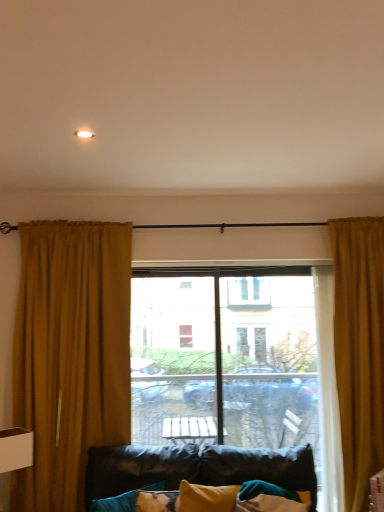
Question: Should I look upward or downward to see golden textured curtain at right, which appears as the 1th curtain when viewed from the right?

Choices:
 (A) down
 (B) up

Answer: (A)

Question: Can you confirm if golden textured curtain at right, which appears as the 1th curtain when viewed from the right, is wider than velvet teal pillow at lower left?

Choices:
 (A) no
 (B) yes

Answer: (B)

Question: Can you confirm if golden textured curtain at right, which is the 2th curtain in left-to-right order, is taller than velvet teal pillow at lower left?

Choices:
 (A) yes
 (B) no

Answer: (A)

Question: Is the depth of golden textured curtain at right, which is the 2th curtain in left-to-right order, greater than that of velvet teal pillow at lower left?

Choices:
 (A) no
 (B) yes

Answer: (B)

Question: Is golden textured curtain at right, which is the 2th curtain in left-to-right order, at the left side of velvet teal pillow at lower left?

Choices:
 (A) no
 (B) yes

Answer: (A)

Question: Can we say golden textured curtain at right, which is the 2th curtain in left-to-right order, lies outside velvet teal pillow at lower left?

Choices:
 (A) yes
 (B) no

Answer: (A)

Question: Does golden textured curtain at right, which is the 2th curtain in left-to-right order, have a larger size compared to velvet teal pillow at lower left?

Choices:
 (A) yes
 (B) no

Answer: (A)

Question: Is velvet teal pillow at lower left bigger than mustard velvet curtain at left, placed as the second curtain when sorted from right to left?

Choices:
 (A) no
 (B) yes

Answer: (A)

Question: From the image's perspective, would you say velvet teal pillow at lower left is positioned over mustard velvet curtain at left, the 1th curtain when ordered from left to right?

Choices:
 (A) no
 (B) yes

Answer: (A)

Question: Does velvet teal pillow at lower left have a greater width compared to mustard velvet curtain at left, placed as the second curtain when sorted from right to left?

Choices:
 (A) no
 (B) yes

Answer: (B)

Question: Can you confirm if velvet teal pillow at lower left is positioned to the left of mustard velvet curtain at left, the 1th curtain when ordered from left to right?

Choices:
 (A) yes
 (B) no

Answer: (B)

Question: Can you confirm if velvet teal pillow at lower left is shorter than mustard velvet curtain at left, placed as the second curtain when sorted from right to left?

Choices:
 (A) no
 (B) yes

Answer: (B)

Question: Is velvet teal pillow at lower left positioned behind mustard velvet curtain at left, placed as the second curtain when sorted from right to left?

Choices:
 (A) no
 (B) yes

Answer: (A)

Question: Is mustard velvet curtain at left, the 1th curtain when ordered from left to right, wider than golden textured curtain at right, which is the 2th curtain in left-to-right order?

Choices:
 (A) yes
 (B) no

Answer: (B)